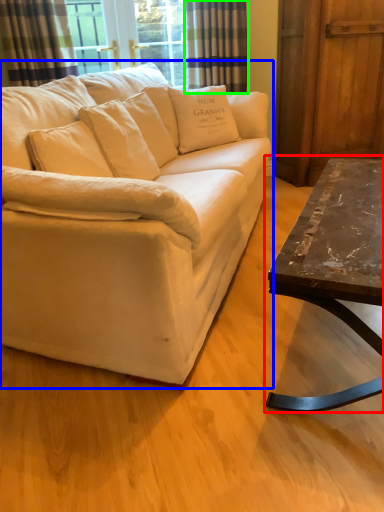
Question: Which object is the closest to the coffee table (highlighted by a red box)? Choose among these: studio couch (highlighted by a blue box) or curtain (highlighted by a green box).

Choices:
 (A) studio couch
 (B) curtain

Answer: (A)